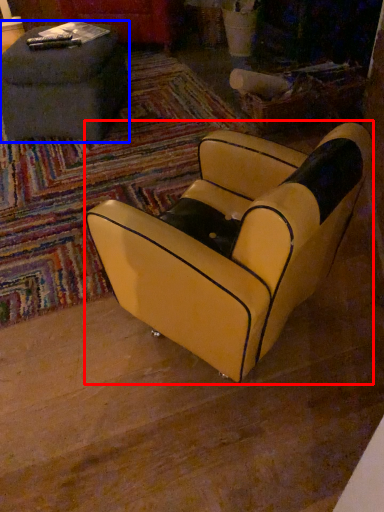
Question: Which of the following is the closest to the observer, chair (highlighted by a red box) or table (highlighted by a blue box)?

Choices:
 (A) chair
 (B) table

Answer: (A)